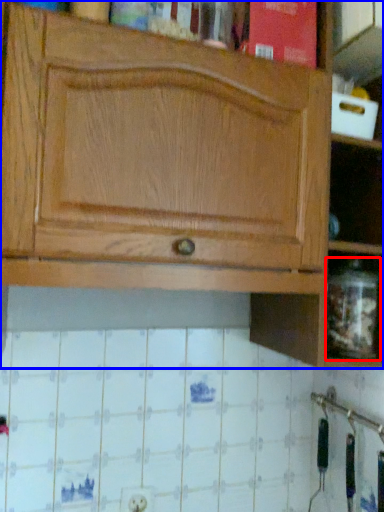
Question: Which object appears farthest to the camera in this image, glass jar (highlighted by a red box) or cabinetry (highlighted by a blue box)?

Choices:
 (A) glass jar
 (B) cabinetry

Answer: (A)